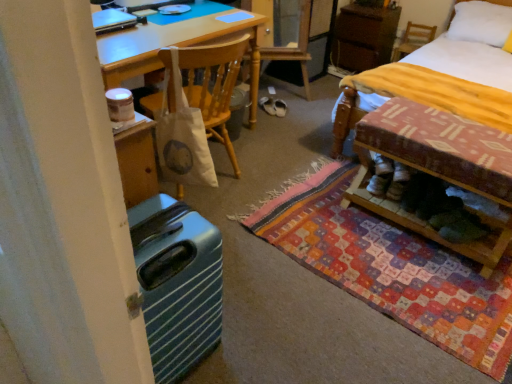
What are the coordinates of `vacant point above wooden bed frame at lower right (from a real-world perspective)` in the screenshot? It's located at (453, 133).